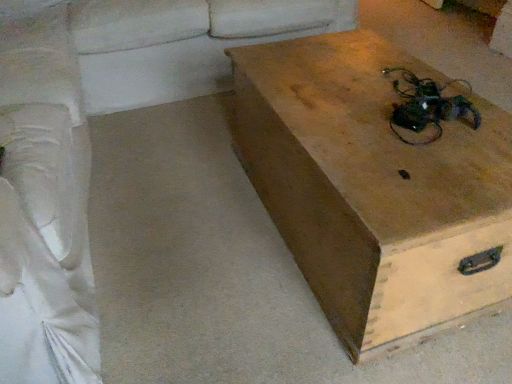
Identify the location of blank space situated above wooden box at center (from a real-world perspective). (414, 130).